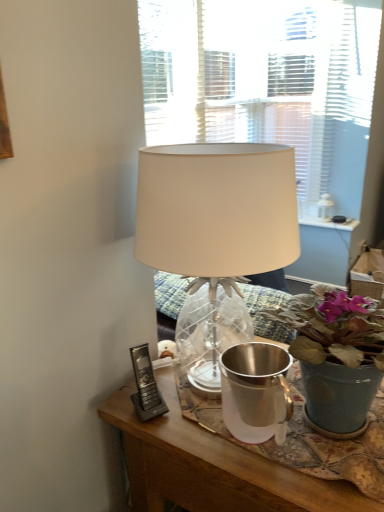
Question: Is black plastic phone at lower left taller or shorter than silver metallic watering can at center?

Choices:
 (A) tall
 (B) short

Answer: (B)

Question: Based on their sizes in the image, would you say black plastic phone at lower left is bigger or smaller than silver metallic watering can at center?

Choices:
 (A) big
 (B) small

Answer: (B)

Question: Considering the real-world distances, which object is closest to the black plastic phone at lower left?

Choices:
 (A) matte gray pot at center
 (B) white fabric lampshade at center
 (C) silver metallic watering can at center

Answer: (C)

Question: Which is farther from the silver metallic watering can at center?

Choices:
 (A) black plastic phone at lower left
 (B) white fabric lampshade at center
 (C) matte gray pot at center

Answer: (B)